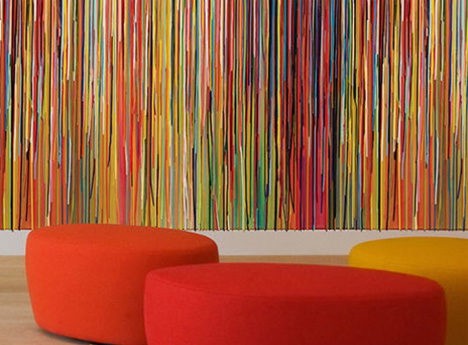
I want to click on yellow ottoman, so click(x=440, y=264).